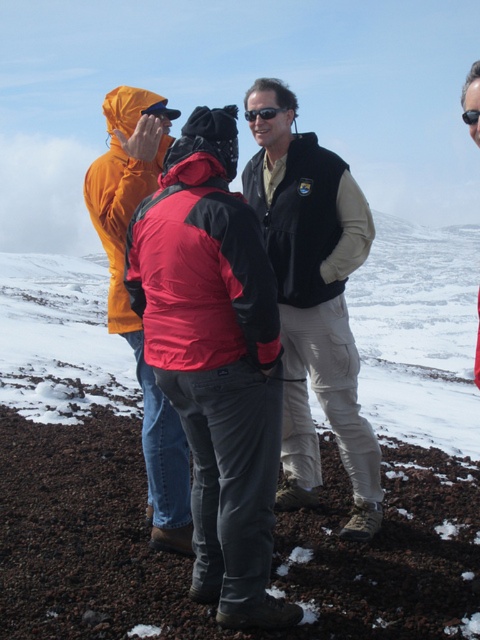
Measure the distance between point (x=66, y=198) and camera.

The distance of point (x=66, y=198) from camera is 115.43 feet.

Does point (57, 168) lie behind point (477, 112)?

Yes.

The image size is (480, 640). What are the coordinates of `white fluffy cloud at upper left` in the screenshot? It's located at (45, 195).

Is velvet black vest at center positioned behind matte orange jacket at left?

Yes, it is.

Based on the photo, who is more forward, (312, 291) or (99, 176)?

Point (99, 176) is more forward.

Describe the element at coordinates (315, 278) in the screenshot. The height and width of the screenshot is (640, 480). I see `velvet black vest at center` at that location.

The height and width of the screenshot is (640, 480). What are the coordinates of `velvet black vest at center` in the screenshot? It's located at (315, 278).

How far apart are velvet black vest at center and white fluffy cloud at upper left?

velvet black vest at center and white fluffy cloud at upper left are 31.62 meters apart.

What do you see at coordinates (315, 278) in the screenshot? I see `velvet black vest at center` at bounding box center [315, 278].

Identify the location of velvet black vest at center. (315, 278).